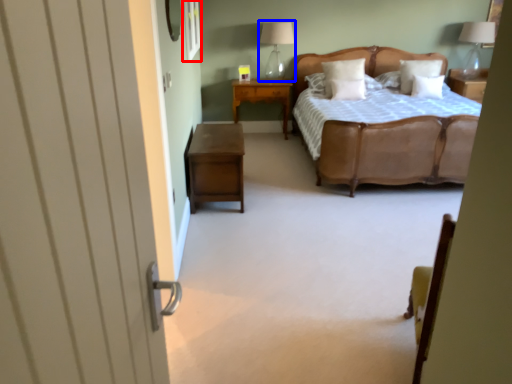
Question: Which object is further to the camera taking this photo, window (highlighted by a red box) or table lamp (highlighted by a blue box)?

Choices:
 (A) window
 (B) table lamp

Answer: (B)